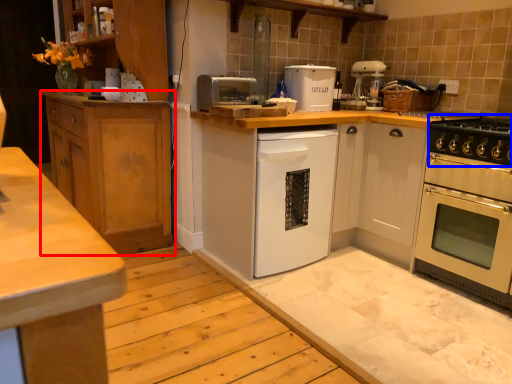
Question: Which object is closer to the camera taking this photo, cabinetry (highlighted by a red box) or gas stove (highlighted by a blue box)?

Choices:
 (A) cabinetry
 (B) gas stove

Answer: (B)